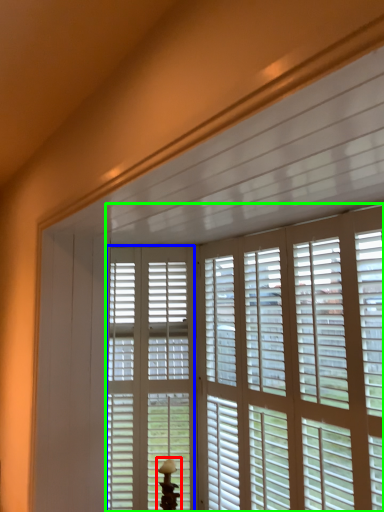
Question: Which object is positioned farthest from table lamp (highlighted by a red box)? Select from screen door (highlighted by a blue box) and window blind (highlighted by a green box).

Choices:
 (A) screen door
 (B) window blind

Answer: (B)